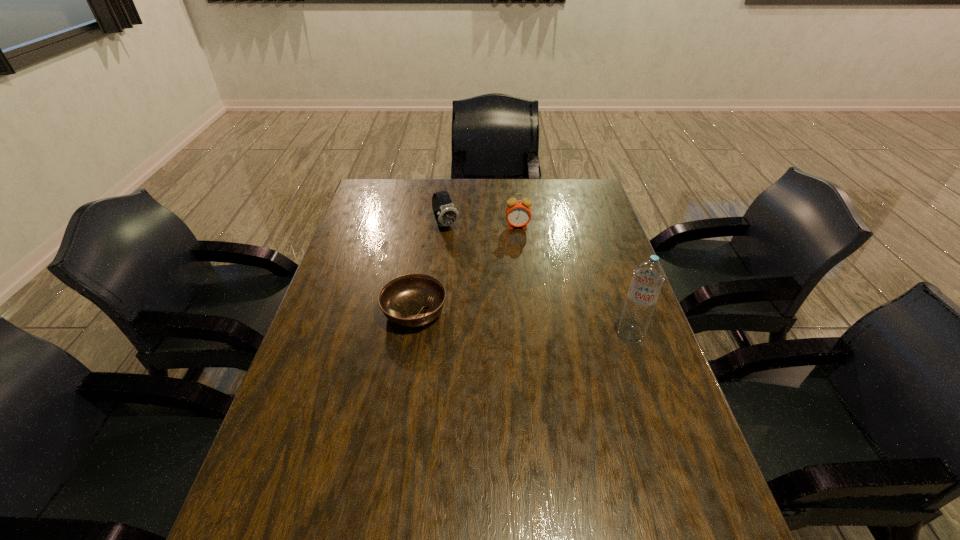
The image size is (960, 540). I want to click on vacant region located on the face of the alarm clock, so click(x=519, y=244).

Image resolution: width=960 pixels, height=540 pixels. Find the location of `vacant space situated on the face of the alarm clock`. vacant space situated on the face of the alarm clock is located at coordinates (523, 283).

Identify the location of free location located on the face of the alarm clock. (519, 244).

Where is `object that is at the right edge`? object that is at the right edge is located at coordinates (648, 276).

The width and height of the screenshot is (960, 540). Find the location of `vacant space at the far edge of the desktop`. vacant space at the far edge of the desktop is located at coordinates (434, 191).

Locate an element on the screen. free space at the near edge of the desktop is located at coordinates (548, 509).

In the image, there is a desktop. Identify the location of vacant space at the left edge. The width and height of the screenshot is (960, 540). (319, 327).

You are a GUI agent. You are given a task and a screenshot of the screen. Output one action in this format:
    pyautogui.click(x=<x>, y=<y>)
    Task: Click on the vacant space at the right edge of the desktop
    The width and height of the screenshot is (960, 540).
    Given the screenshot: What is the action you would take?
    pyautogui.click(x=597, y=217)

This screenshot has width=960, height=540. In order to click on free space between the soup bowl and the rightmost object in this screenshot , I will do `click(522, 323)`.

At what (x,y) coordinates should I click in order to perform the action: click on free space between the soup bowl and the water bottle. Please return your answer as a coordinate pair (x, y). Looking at the image, I should click on (522, 323).